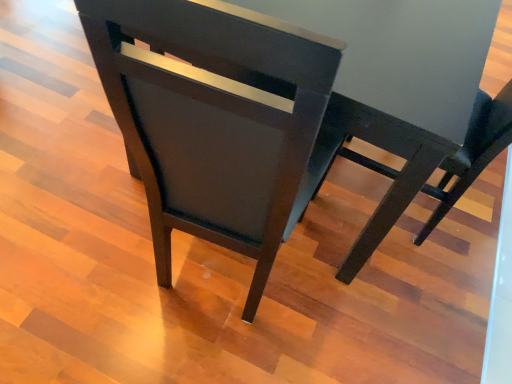
Question: Is matte dark wood chair at center outside of matte black table at center?

Choices:
 (A) yes
 (B) no

Answer: (A)

Question: Does matte dark wood chair at center have a smaller size compared to matte black table at center?

Choices:
 (A) no
 (B) yes

Answer: (B)

Question: From the image's perspective, is matte dark wood chair at center above matte black table at center?

Choices:
 (A) yes
 (B) no

Answer: (B)

Question: From the image's perspective, does matte dark wood chair at center appear lower than matte black table at center?

Choices:
 (A) no
 (B) yes

Answer: (B)

Question: From a real-world perspective, does matte dark wood chair at center sit lower than matte black table at center?

Choices:
 (A) yes
 (B) no

Answer: (B)

Question: Can you confirm if matte dark wood chair at center is positioned to the right of matte black table at center?

Choices:
 (A) yes
 (B) no

Answer: (B)

Question: From a real-world perspective, does matte black table at center stand above matte dark wood chair at center?

Choices:
 (A) no
 (B) yes

Answer: (A)

Question: Can you confirm if matte black table at center is shorter than matte dark wood chair at center?

Choices:
 (A) yes
 (B) no

Answer: (A)

Question: Does matte black table at center have a greater height compared to matte dark wood chair at center?

Choices:
 (A) yes
 (B) no

Answer: (B)

Question: Does matte black table at center lie behind matte dark wood chair at center?

Choices:
 (A) no
 (B) yes

Answer: (B)

Question: Can you confirm if matte black table at center is positioned to the right of matte dark wood chair at center?

Choices:
 (A) yes
 (B) no

Answer: (A)

Question: From the image's perspective, is matte black table at center beneath matte dark wood chair at center?

Choices:
 (A) no
 (B) yes

Answer: (A)

Question: Considering the relative positions of matte black table at center and matte dark wood chair at center in the image provided, is matte black table at center to the left or to the right of matte dark wood chair at center?

Choices:
 (A) left
 (B) right

Answer: (B)